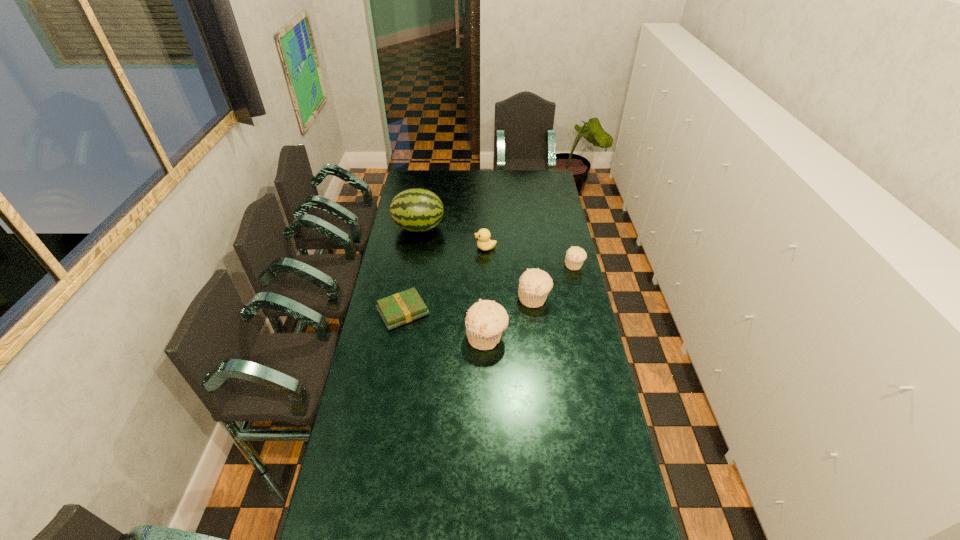
Please point a vacant point for placing a muffin on the left. Please provide its 2D coordinates. Your answer should be formatted as a tuple, i.e. [(x, y)], where the tuple contains the x and y coordinates of a point satisfying the conditions above.

[(429, 384)]